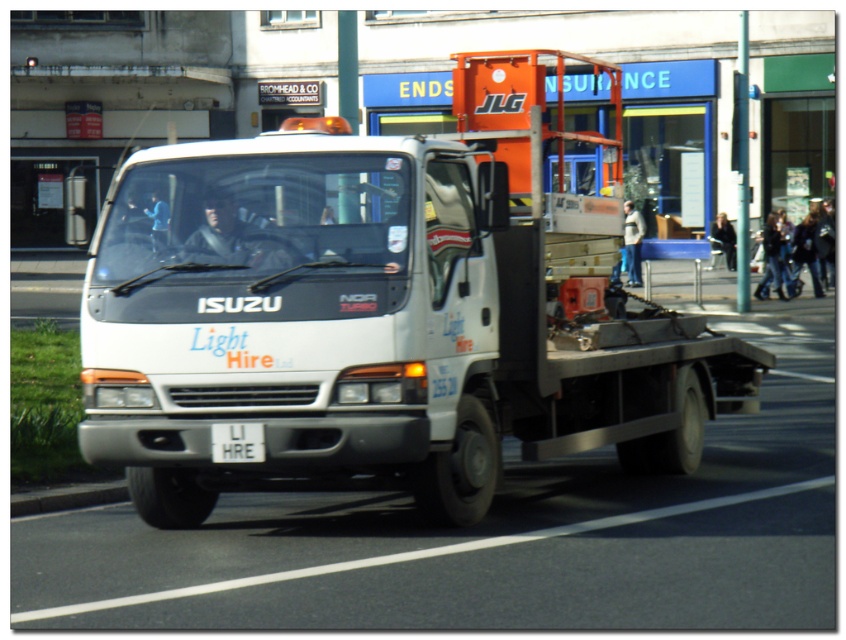
Question: Is white metallic truck at center further to the viewer compared to white plastic license plate at center?

Choices:
 (A) yes
 (B) no

Answer: (A)

Question: Among these points, which one is farthest from the camera?

Choices:
 (A) (246, 324)
 (B) (213, 449)

Answer: (B)

Question: Is white metallic truck at center further to the viewer compared to white plastic license plate at center?

Choices:
 (A) no
 (B) yes

Answer: (B)

Question: Can you confirm if white metallic truck at center is smaller than white plastic license plate at center?

Choices:
 (A) no
 (B) yes

Answer: (A)